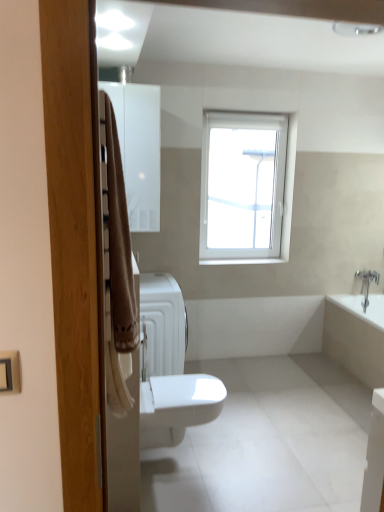
Question: Is white plastic window at upper center outside of white matte radiator at center?

Choices:
 (A) no
 (B) yes

Answer: (B)

Question: Considering the relative sizes of white plastic window at upper center and white matte radiator at center in the image provided, is white plastic window at upper center wider than white matte radiator at center?

Choices:
 (A) yes
 (B) no

Answer: (B)

Question: Considering the relative sizes of white plastic window at upper center and white matte radiator at center in the image provided, is white plastic window at upper center thinner than white matte radiator at center?

Choices:
 (A) yes
 (B) no

Answer: (A)

Question: Is white matte radiator at center completely or partially inside white plastic window at upper center?

Choices:
 (A) no
 (B) yes

Answer: (A)

Question: Is white plastic window at upper center next to white matte radiator at center?

Choices:
 (A) yes
 (B) no

Answer: (B)

Question: Does white plastic window at upper center have a greater height compared to white matte radiator at center?

Choices:
 (A) no
 (B) yes

Answer: (B)

Question: Could you tell me if white plastic window at upper center is facing white glossy bathtub at lower right?

Choices:
 (A) no
 (B) yes

Answer: (A)

Question: Considering the relative sizes of white plastic window at upper center and white glossy bathtub at lower right in the image provided, is white plastic window at upper center bigger than white glossy bathtub at lower right?

Choices:
 (A) no
 (B) yes

Answer: (A)

Question: Is white plastic window at upper center positioned in front of white glossy bathtub at lower right?

Choices:
 (A) yes
 (B) no

Answer: (B)

Question: From the image's perspective, is white plastic window at upper center beneath white glossy bathtub at lower right?

Choices:
 (A) yes
 (B) no

Answer: (B)

Question: Is white plastic window at upper center oriented away from white glossy bathtub at lower right?

Choices:
 (A) yes
 (B) no

Answer: (B)

Question: From a real-world perspective, is white plastic window at upper center located higher than white glossy bathtub at lower right?

Choices:
 (A) no
 (B) yes

Answer: (B)

Question: From the image's perspective, is white glossy medicine cabinet at upper left under white glossy bathtub at lower right?

Choices:
 (A) yes
 (B) no

Answer: (B)